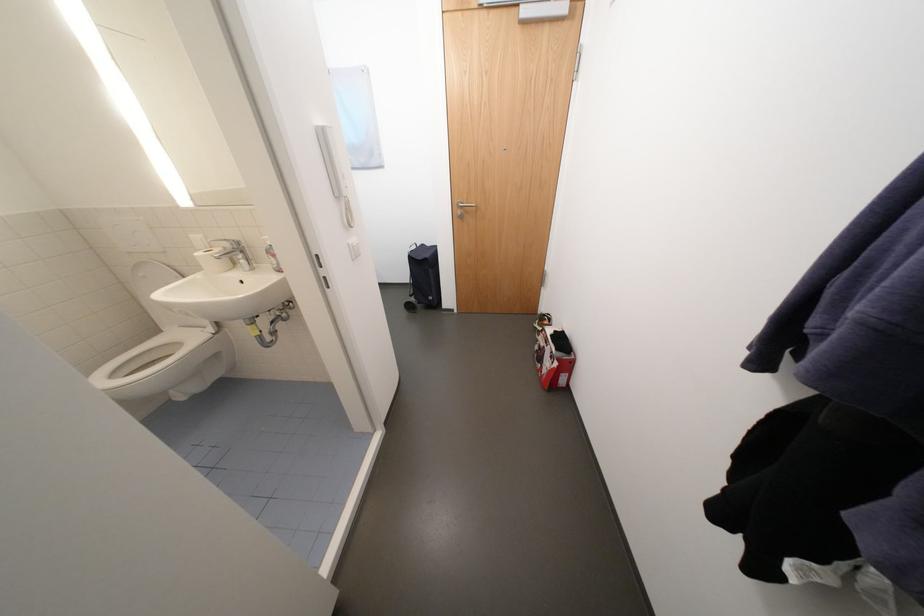
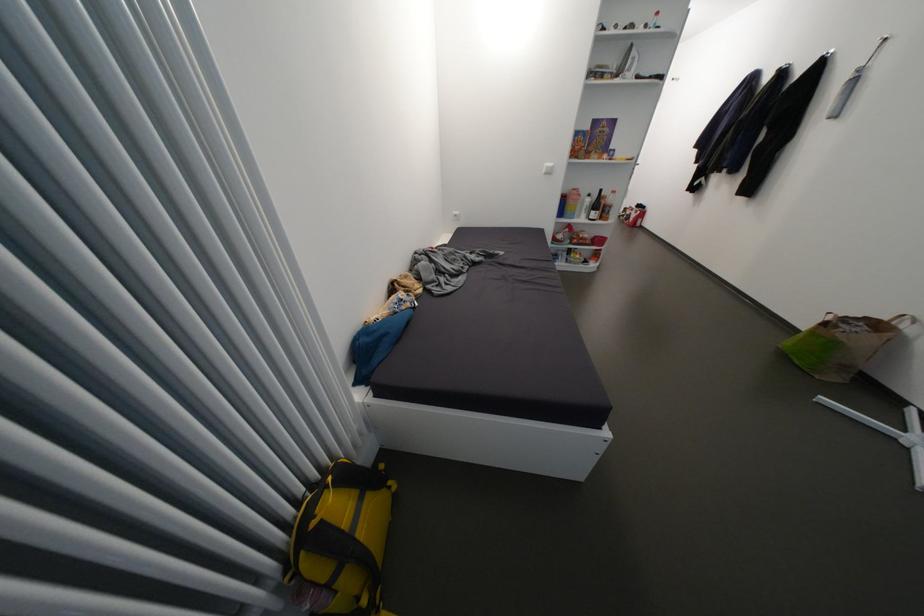
Where in the second image is the point corresponding to pixel 558 358 from the first image?

(642, 214)